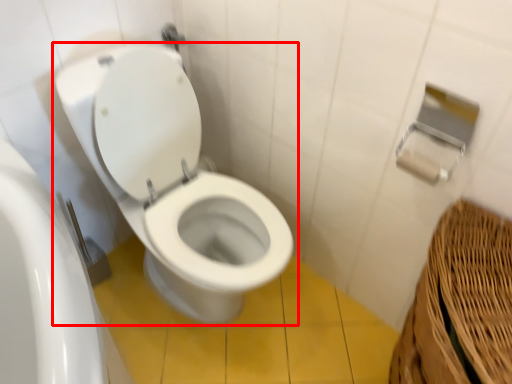
Question: In this image, where is toilet (annotated by the red box) located relative to toilet paper?

Choices:
 (A) right
 (B) left

Answer: (B)